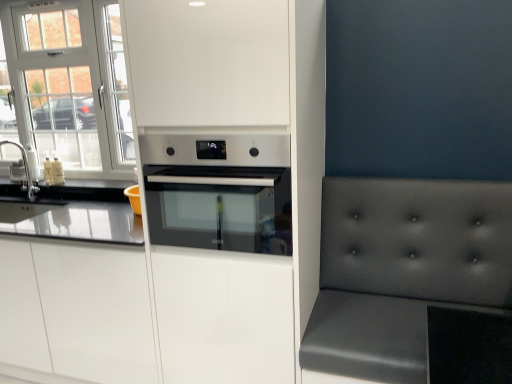
Question: Does point (20, 97) appear closer or farther from the camera than point (142, 301)?

Choices:
 (A) closer
 (B) farther

Answer: (B)

Question: Is white glass window at upper left inside or outside of white matte oven at center, placed as the second cabinetry when sorted from left to right?

Choices:
 (A) inside
 (B) outside

Answer: (B)

Question: Estimate the real-world distances between objects in this image. Which object is farther from the white matte cabinet at center, which ranks as the second cabinetry in right-to-left order?

Choices:
 (A) white glass window at upper left
 (B) matte gray cushion at right
 (C) satin steel oven at center
 (D) brushed metal sink at left
 (E) white matte oven at center, arranged as the first cabinetry when viewed from the right

Answer: (B)

Question: Considering the real-world distances, which object is closest to the white matte cabinet at center, which is the 1th cabinetry from left to right?

Choices:
 (A) white matte oven at center, placed as the second cabinetry when sorted from left to right
 (B) brushed metal sink at left
 (C) matte gray cushion at right
 (D) white glass window at upper left
 (E) satin steel oven at center

Answer: (A)